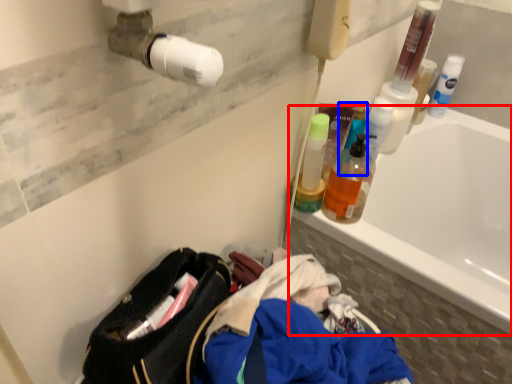
Question: Which of the following is the farthest to the observer, bathtub (highlighted by a red box) or cleaning product (highlighted by a blue box)?

Choices:
 (A) bathtub
 (B) cleaning product

Answer: (B)